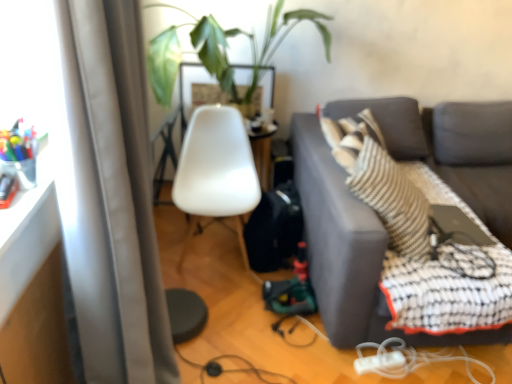
Question: From their relative heights in the image, would you say green leafy plant at upper center is taller or shorter than black rubber cable at lower center, arranged as the 2th cable when viewed from the right?

Choices:
 (A) short
 (B) tall

Answer: (B)

Question: Would you say green leafy plant at upper center is inside or outside black rubber cable at lower center, which appears as the 1th cable when viewed from the left?

Choices:
 (A) inside
 (B) outside

Answer: (B)

Question: Estimate the real-world distances between objects in this image. Which object is farther from the white plastic cable at lower right, acting as the second cable starting from the left?

Choices:
 (A) black rubber cable at lower center, which appears as the 1th cable when viewed from the left
 (B) white matte chair at center
 (C) dark gray fabric couch at right
 (D) white plastic extension cord at lower center
 (E) black matte laptop at right

Answer: (B)

Question: Estimate the real-world distances between objects in this image. Which object is closer to the white matte chair at center?

Choices:
 (A) white plastic extension cord at lower center
 (B) white plastic cable at lower right, acting as the second cable starting from the left
 (C) satin gray curtain at left
 (D) green leafy plant at upper center
 (E) dark gray fabric couch at right

Answer: (D)